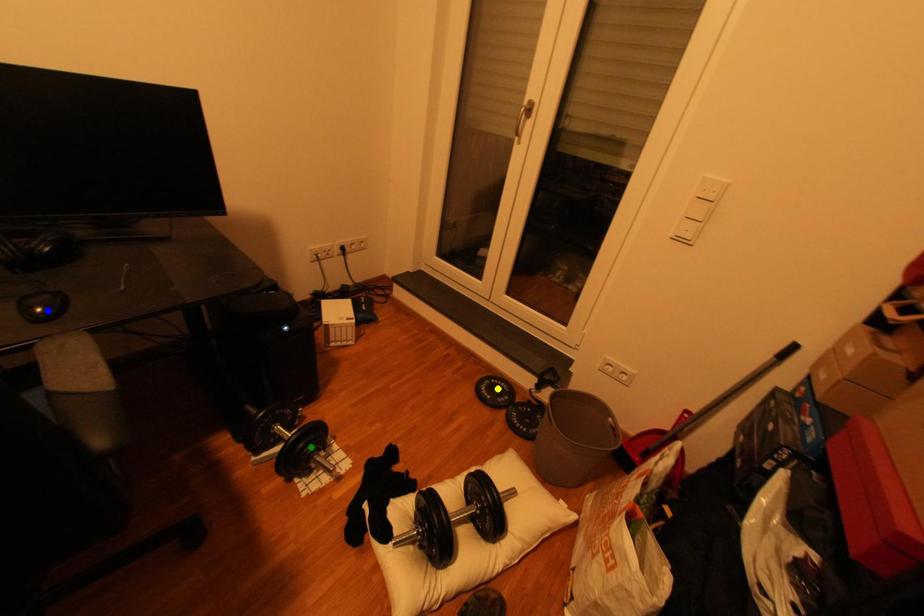
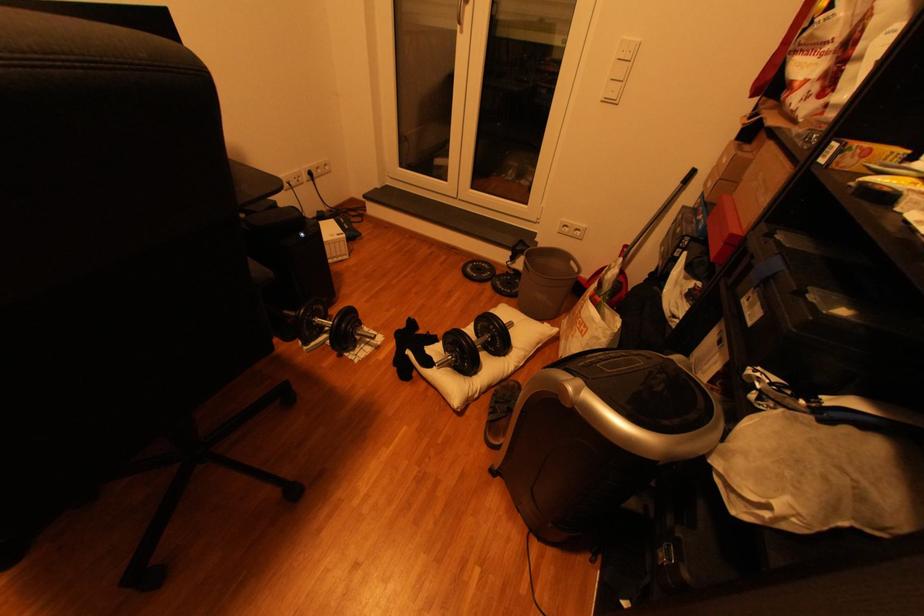
I am providing you with two images of the same scene from different viewpoints. Three points are marked in image1. Which point corresponds to a part or object that is occluded in image2?In image1, three points are marked. Which of them correspond to a part or object that is occluded in image2?Among the three points shown in image1, which one corresponds to a part or object that is no longer visible due to occlusion in image2?

Invisible in image2: blue point.